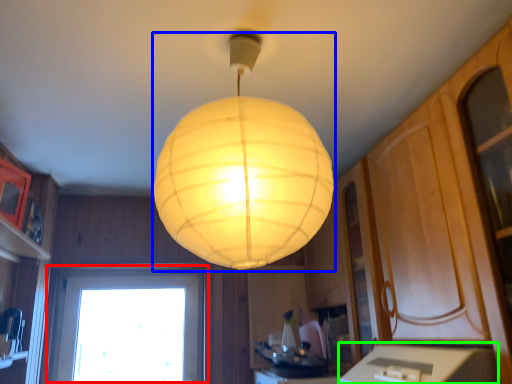
Question: Which is farther away from window (highlighted by a red box)? lamp (highlighted by a blue box) or counter top (highlighted by a green box)?

Choices:
 (A) lamp
 (B) counter top

Answer: (A)